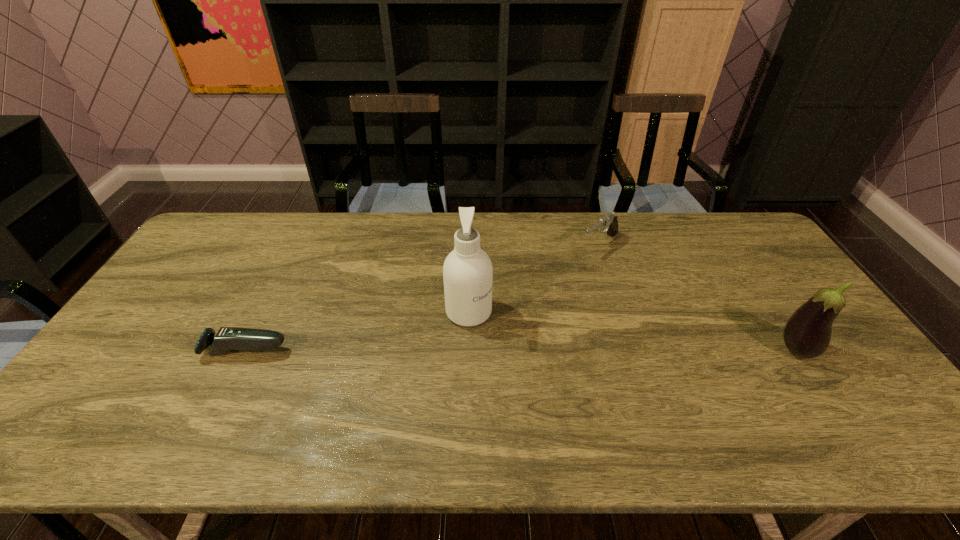
This screenshot has height=540, width=960. In the image, there is a desktop. What are the coordinates of `vacant space at the near edge` in the screenshot? It's located at (451, 397).

Where is `free region at the left edge of the desktop`? free region at the left edge of the desktop is located at coordinates (186, 255).

I want to click on free region at the near left corner, so point(136,383).

In the image, there is a desktop. Identify the location of vacant space at the far right corner. (766, 248).

Locate an element on the screen. This screenshot has height=540, width=960. vacant point located between the electric shaver and the second object from right to left is located at coordinates (422, 297).

At what (x,y) coordinates should I click in order to perform the action: click on vacant area that lies between the third object from left to right and the electric shaver. Please return your answer as a coordinate pair (x, y). Looking at the image, I should click on (422, 297).

The image size is (960, 540). I want to click on vacant region between the rightmost object and the shortest object, so click(x=520, y=350).

Where is `empty location between the third object from left to right and the shortest object`? The height and width of the screenshot is (540, 960). empty location between the third object from left to right and the shortest object is located at coordinates (422, 297).

This screenshot has height=540, width=960. Find the location of `vacant area between the third object from right to left and the rightmost object`. vacant area between the third object from right to left and the rightmost object is located at coordinates (633, 331).

Find the location of a particular element. free space between the leftmost object and the gun is located at coordinates (422, 297).